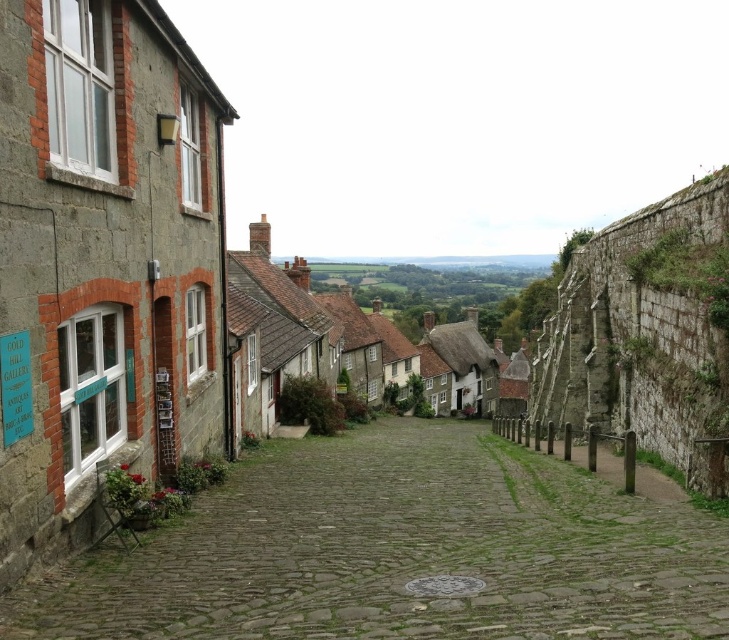
Can you confirm if green cobblestone path at center is smaller than rustic stone houses at center?

Yes.

Does green cobblestone path at center have a greater height compared to rustic stone houses at center?

In fact, green cobblestone path at center may be shorter than rustic stone houses at center.

Between point (359, 618) and point (370, 369), which one is positioned behind?

The point (370, 369) is behind.

Where is `green cobblestone path at center`? The width and height of the screenshot is (729, 640). green cobblestone path at center is located at coordinates (397, 552).